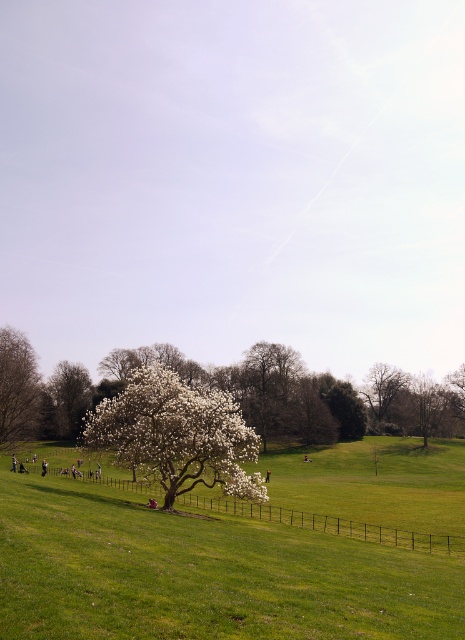
Question: Considering the real-world distances, which object is farthest from the green grassy field at center?

Choices:
 (A) white fluffy tree at center
 (B) smooth bark tree at center
 (C) white fluffy tree at lower left

Answer: (B)

Question: Which is farther from the smooth bark tree at center?

Choices:
 (A) white fluffy tree at lower left
 (B) white fluffy tree at center

Answer: (A)

Question: Based on their relative distances, which object is nearer to the green grassy field at center?

Choices:
 (A) white textured tree at left
 (B) white fluffy tree at lower left
 (C) smooth bark tree at center

Answer: (A)

Question: Observing the image, what is the correct spatial positioning of white fluffy tree at center in reference to smooth bark tree at center?

Choices:
 (A) right
 (B) left

Answer: (B)

Question: Is the position of white fluffy tree at center more distant than that of smooth bark tree at center?

Choices:
 (A) no
 (B) yes

Answer: (A)

Question: Is green grassy field at center positioned in front of white fluffy tree at center?

Choices:
 (A) yes
 (B) no

Answer: (A)